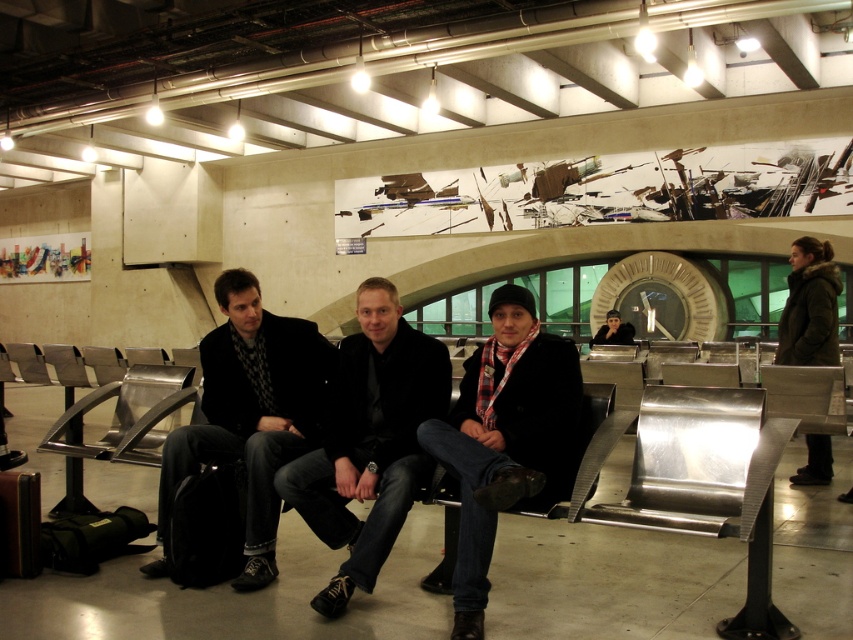
Question: Which object is the farthest from the black matte jacket at center?

Choices:
 (A) plaid fabric shirt at center
 (B) plaid scarf at center
 (C) matte black jacket at center

Answer: (A)

Question: Which is farther from the plaid fabric shirt at center?

Choices:
 (A) black matte jacket at center
 (B) matte black jacket at center

Answer: (A)

Question: Can you confirm if black matte jacket at center is positioned below plaid fabric shirt at center?

Choices:
 (A) yes
 (B) no

Answer: (A)

Question: Which of these objects is positioned farthest from the black matte jacket at center?

Choices:
 (A) matte black jacket at center
 (B) plaid fabric shirt at center

Answer: (B)

Question: Does black matte jacket at center appear under matte black jacket at center?

Choices:
 (A) yes
 (B) no

Answer: (A)

Question: Does black matte jacket at center have a lesser width compared to plaid fabric shirt at center?

Choices:
 (A) yes
 (B) no

Answer: (B)